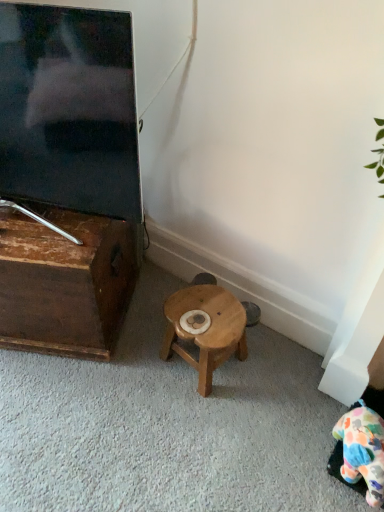
What is the approximate height of fluffy multicolored plush at lower right?

It is 8.14 inches.

Identify the location of wooden stool at center. (205, 329).

Does point (377, 490) appear closer or farther from the camera than point (54, 312)?

Point (377, 490) is closer to the camera than point (54, 312).

Would you say fluffy multicolored plush at lower right is a long distance from wooden table at left?

That's not correct — fluffy multicolored plush at lower right is a little close to wooden table at left.

How many degrees apart are the facing directions of fluffy multicolored plush at lower right and wooden table at left?

The facing directions of fluffy multicolored plush at lower right and wooden table at left are 20.5 degrees apart.

Considering the positions of objects fluffy multicolored plush at lower right and wooden table at left in the image provided, who is behind, fluffy multicolored plush at lower right or wooden table at left?

wooden table at left is further from the camera.

In the scene shown: Between matte black tv at left and fluffy multicolored plush at lower right, which one is positioned in front?

matte black tv at left is in front.

Is matte black tv at left facing away from fluffy multicolored plush at lower right?

That's not correct — matte black tv at left is not looking away from fluffy multicolored plush at lower right.

Considering the positions of objects matte black tv at left and fluffy multicolored plush at lower right in the image provided, who is more to the left, matte black tv at left or fluffy multicolored plush at lower right?

From the viewer's perspective, matte black tv at left appears more on the left side.

Can you confirm if fluffy multicolored plush at lower right is positioned to the right of wooden stool at center?

Yes, fluffy multicolored plush at lower right is to the right of wooden stool at center.

Does fluffy multicolored plush at lower right have a lesser width compared to wooden stool at center?

Yes, fluffy multicolored plush at lower right is thinner than wooden stool at center.

Is point (362, 449) more distant than point (233, 329)?

No, it is not.

Which of these two, fluffy multicolored plush at lower right or wooden stool at center, stands shorter?

With less height is fluffy multicolored plush at lower right.

Is wooden stool at center beside matte black tv at left?

No, wooden stool at center is not beside matte black tv at left.

Could you tell me if wooden stool at center is turned towards matte black tv at left?

No, wooden stool at center does not turn towards matte black tv at left.

Between wooden stool at center and matte black tv at left, which one has larger size?

matte black tv at left is bigger.

Where is `television above the wooden stool at center (from a real-world perspective)`? television above the wooden stool at center (from a real-world perspective) is located at coordinates (x=69, y=109).

Are wooden table at left and matte black tv at left located far from each other?

They are positioned close to each other.

Considering the sizes of wooden table at left and matte black tv at left in the image, is wooden table at left taller or shorter than matte black tv at left?

Clearly, wooden table at left is shorter compared to matte black tv at left.

Find the location of a particular element. This screenshot has height=512, width=384. table below the matte black tv at left (from a real-world perspective) is located at coordinates (65, 282).

Is wooden table at left wider or thinner than matte black tv at left?

Considering their sizes, wooden table at left looks broader than matte black tv at left.

Can you confirm if fluffy multicolored plush at lower right is taller than matte black tv at left?

No.

At what (x,y) coordinates should I click in order to perform the action: click on toy on the right of matte black tv at left. Please return your answer as a coordinate pair (x, y). Looking at the image, I should click on (362, 450).

From a real-world perspective, is fluffy multicolored plush at lower right located beneath matte black tv at left?

Yes, from a real-world perspective, fluffy multicolored plush at lower right is below matte black tv at left.

Which object is further away from the camera taking this photo, fluffy multicolored plush at lower right or matte black tv at left?

fluffy multicolored plush at lower right is behind.

Considering the relative sizes of wooden stool at center and wooden table at left in the image provided, is wooden stool at center taller than wooden table at left?

In fact, wooden stool at center may be shorter than wooden table at left.

Is wooden stool at center in front of wooden table at left?

No, it is not.

Looking at their sizes, would you say wooden stool at center is wider or thinner than wooden table at left?

Clearly, wooden stool at center has less width compared to wooden table at left.

From a real-world perspective, between wooden stool at center and wooden table at left, who is vertically lower?

wooden stool at center, from a real-world perspective.

Locate an element on the screen. table positioned vertically above the fluffy multicolored plush at lower right (from a real-world perspective) is located at coordinates (65, 282).

Locate an element on the screen. Image resolution: width=384 pixels, height=512 pixels. television lying above the fluffy multicolored plush at lower right (from the image's perspective) is located at coordinates (69, 109).

Based on their spatial positions, is wooden stool at center or matte black tv at left further from wooden table at left?

Among the two, wooden stool at center is located further to wooden table at left.

Considering their positions, is matte black tv at left positioned closer to fluffy multicolored plush at lower right than wooden table at left?

wooden table at left is positioned closer to the anchor fluffy multicolored plush at lower right.

Considering their positions, is fluffy multicolored plush at lower right positioned closer to wooden table at left than matte black tv at left?

matte black tv at left.

From the image, which object appears to be nearer to wooden stool at center, fluffy multicolored plush at lower right or wooden table at left?

wooden table at left is positioned closer to the anchor wooden stool at center.

In the scene shown: When comparing their distances from fluffy multicolored plush at lower right, does wooden table at left or wooden stool at center seem further?

Based on the image, wooden table at left appears to be further to fluffy multicolored plush at lower right.

Based on their spatial positions, is fluffy multicolored plush at lower right or wooden table at left closer to matte black tv at left?

wooden table at left lies closer to matte black tv at left than the other object.

Which object lies nearer to the anchor point matte black tv at left, fluffy multicolored plush at lower right or wooden stool at center?

Based on the image, wooden stool at center appears to be nearer to matte black tv at left.

From the image, which object appears to be farther from wooden table at left, matte black tv at left or wooden stool at center?

The object further to wooden table at left is wooden stool at center.

Find the location of `television between wooden table at left and wooden stool at center from left to right`. television between wooden table at left and wooden stool at center from left to right is located at coordinates (69, 109).

At what (x,y) coordinates should I click in order to perform the action: click on television situated between wooden table at left and fluffy multicolored plush at lower right from left to right. Please return your answer as a coordinate pair (x, y). This screenshot has width=384, height=512. Looking at the image, I should click on coord(69,109).

The image size is (384, 512). Find the location of `stool situated between wooden table at left and fluffy multicolored plush at lower right from left to right`. stool situated between wooden table at left and fluffy multicolored plush at lower right from left to right is located at coordinates (205, 329).

Where is `stool located between matte black tv at left and fluffy multicolored plush at lower right in the left-right direction`? stool located between matte black tv at left and fluffy multicolored plush at lower right in the left-right direction is located at coordinates click(205, 329).